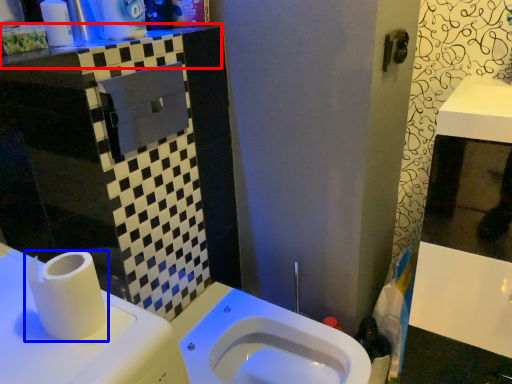
Question: Among these objects, which one is nearest to the camera, counter top (highlighted by a red box) or toilet paper (highlighted by a blue box)?

Choices:
 (A) counter top
 (B) toilet paper

Answer: (B)